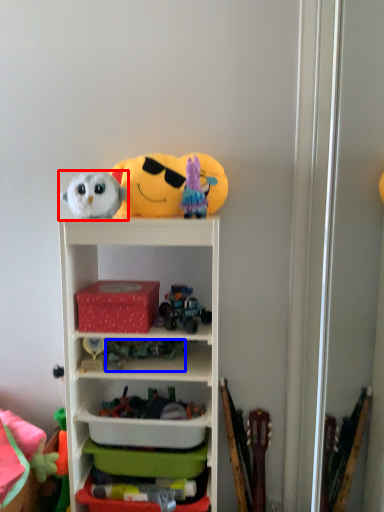
Question: Which object appears farthest to the camera in this image, toy (highlighted by a red box) or toy (highlighted by a blue box)?

Choices:
 (A) toy
 (B) toy

Answer: (B)